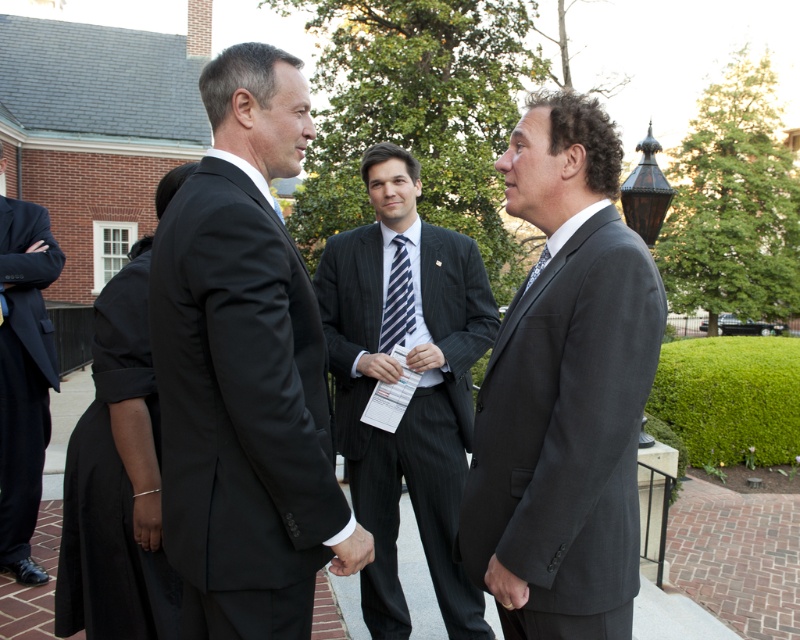
You are a photographer at this event and need to capture a photo of both the black suit at center and the dark gray suit at left. Which person should you focus on first to ensure both are in the frame?

You should focus on the black suit at center first since it is in front of the dark gray suit at left, ensuring both are visible in the photo.

You are taking a photo of the scene and want to focus on both the point at coordinates point (26, 563) and point (544, 260). Which point should you adjust your focus to first to ensure both are in focus?

You should focus on point (544, 260) first because it is farther away from the camera than point (26, 563). By focusing on the farther point, the closer point will also be within the depth of field, ensuring both are in focus.

You are a photographer at this event and need to capture a photo that includes both the dark gray suit at left and the blue striped tie at center. Based on their heights, which one should you focus on first to ensure both are in frame?

The dark gray suit at left is much taller than the blue striped tie at center, so you should focus on the dark gray suit at left first to ensure both are in frame.